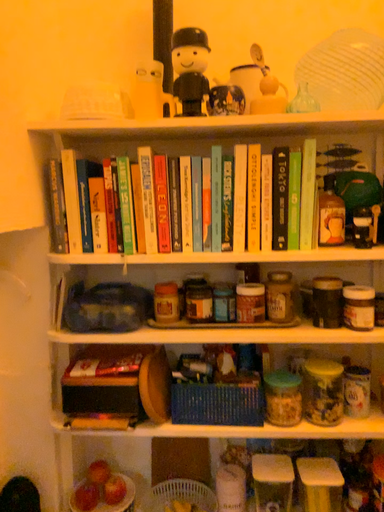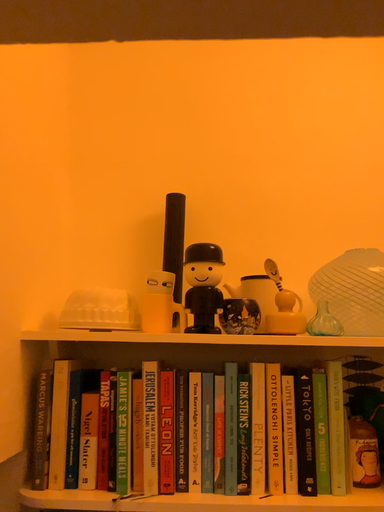
Question: How did the camera likely rotate when shooting the video?

Choices:
 (A) rotated downward
 (B) rotated upward

Answer: (B)